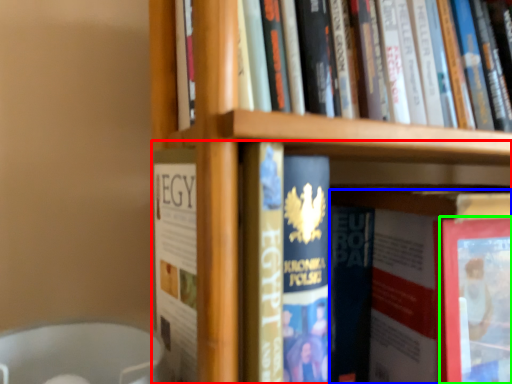
Question: Which object is positioned closest to book (highlighted by a red box)? Select from book (highlighted by a blue box) and paperback book (highlighted by a green box).

Choices:
 (A) book
 (B) paperback book

Answer: (A)